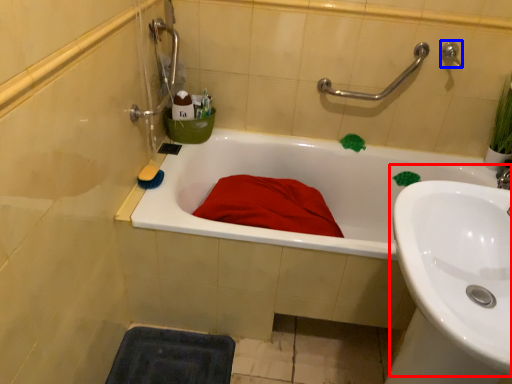
Question: Among these objects, which one is farthest to the camera, sink (highlighted by a red box) or plumbing fixture (highlighted by a blue box)?

Choices:
 (A) sink
 (B) plumbing fixture

Answer: (B)